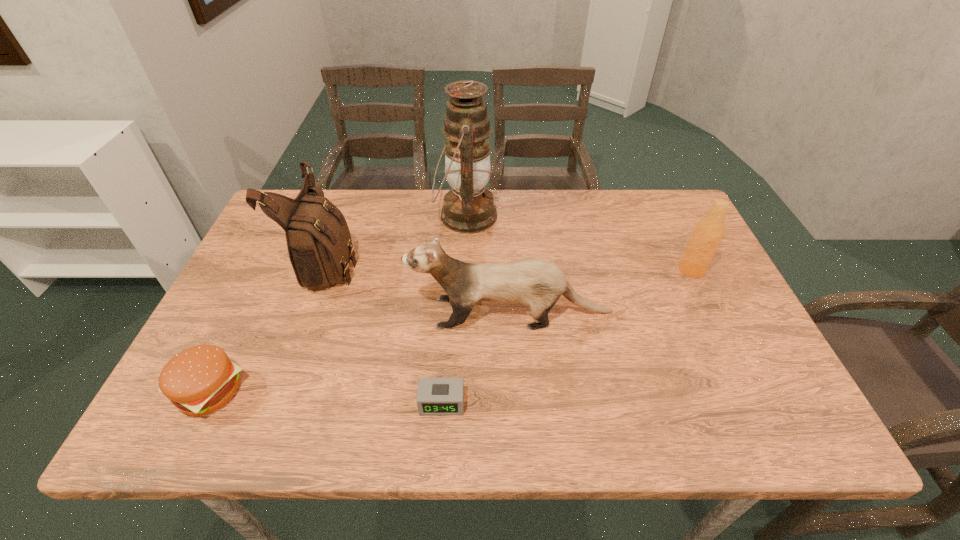
At what (x,y) coordinates should I click in order to perform the action: click on object that is at the far left corner. Please return your answer as a coordinate pair (x, y). This screenshot has width=960, height=540. Looking at the image, I should click on (319, 243).

This screenshot has width=960, height=540. In order to click on object that is at the near left corner in this screenshot , I will do `click(199, 380)`.

Identify the location of vacant space at the far edge of the desktop. 411,231.

Image resolution: width=960 pixels, height=540 pixels. Find the location of `vacant space at the near edge of the desktop`. vacant space at the near edge of the desktop is located at coordinates (315, 409).

The width and height of the screenshot is (960, 540). I want to click on free space at the right edge of the desktop, so (x=701, y=377).

Locate an element on the screen. vacant area at the far right corner is located at coordinates (674, 225).

You are a GUI agent. You are given a task and a screenshot of the screen. Output one action in this format:
    pyautogui.click(x=<x>, y=<y>)
    Task: Click on the unoccupied area between the hamburger and the ferret
    This screenshot has height=540, width=960.
    Given the screenshot: What is the action you would take?
    pyautogui.click(x=360, y=352)

You are a GUI agent. You are given a task and a screenshot of the screen. Output one action in this format:
    pyautogui.click(x=<x>, y=<y>)
    Task: Click on the free area in between the shortest object and the rightmost object
    This screenshot has height=540, width=960.
    Given the screenshot: What is the action you would take?
    pyautogui.click(x=566, y=336)

Where is `free spot between the shortest object and the ferret`? free spot between the shortest object and the ferret is located at coordinates (476, 358).

This screenshot has height=540, width=960. I want to click on free space between the rightmost object and the ferret, so click(x=601, y=291).